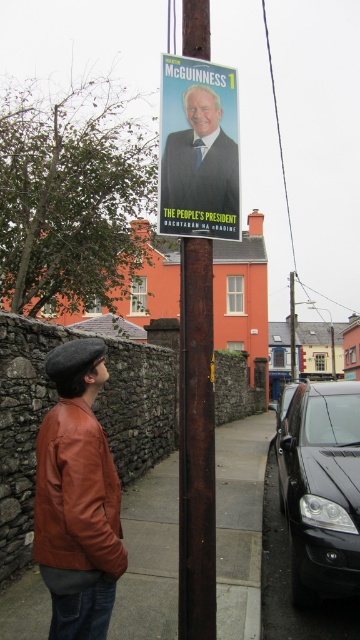
You are a pedestrian standing in the middle of the street. You see a black glossy car at right and a shiny black car at center. Which car is closer to your left side?

The black glossy car at right is positioned on the left side of the shiny black car at center, so it is closer to your left side.

You are a photographer trying to capture the entire political campaign poster on the rusty metal pole at center without any obstructions. There is a black glossy car at right parked nearby. Based on their sizes, can you determine if the car might block your view of the poster?

The black glossy car at right is bigger than the rusty metal pole at center. Since the car is larger, it could potentially block the view of the poster on the pole depending on its position relative to the photographer.

You are standing at the point labeled as point (321, 490). What object is located to your right?

The black glossy car at right is located to your right.